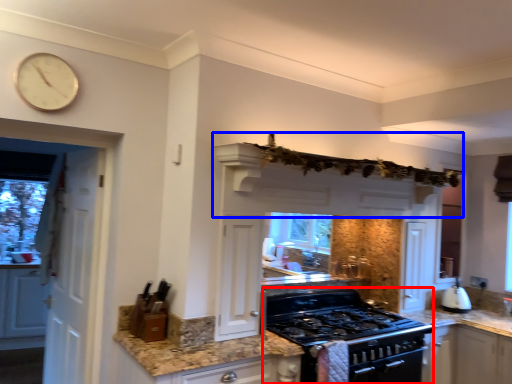
Question: Among these objects, which one is farthest to the camera, appliance (highlighted by a red box) or exhaust hood (highlighted by a blue box)?

Choices:
 (A) appliance
 (B) exhaust hood

Answer: (A)